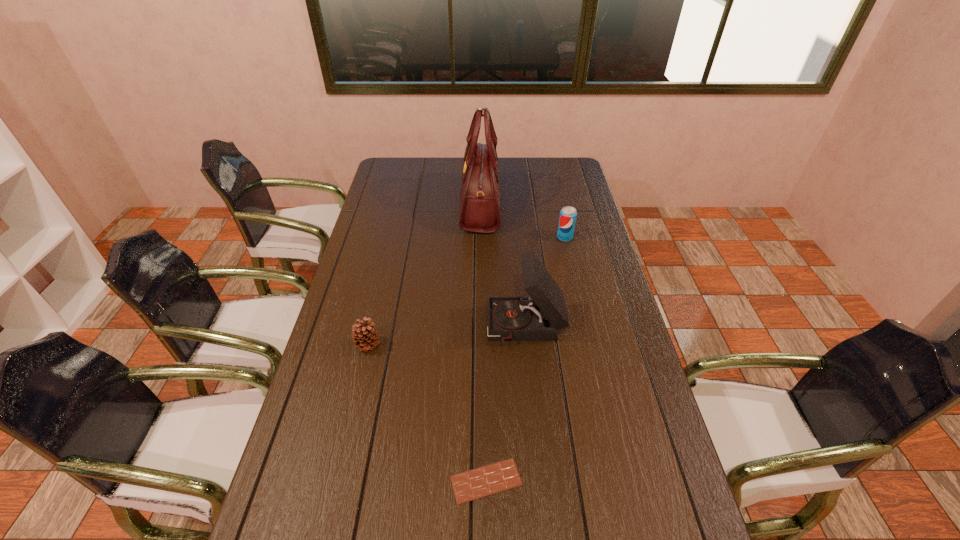
Identify the location of vacant space that is in between the leftmost object and the phonograph_record. Image resolution: width=960 pixels, height=540 pixels. (446, 336).

The image size is (960, 540). Identify the location of vacant space that is in between the rightmost object and the chocolate bar. (525, 359).

Where is `object that is the second closest one to the second tallest object`? The image size is (960, 540). object that is the second closest one to the second tallest object is located at coordinates tap(470, 485).

The height and width of the screenshot is (540, 960). Find the location of `object that stands as the fourth closest to the pinecone`. object that stands as the fourth closest to the pinecone is located at coordinates (568, 214).

Find the location of a particular element. The image size is (960, 540). vacant space that satisfies the following two spatial constraints: 1. on the front-facing side of the shortest object; 2. on the right side of the tallest object is located at coordinates (481, 481).

You are a GUI agent. You are given a task and a screenshot of the screen. Output one action in this format:
    pyautogui.click(x=<x>, y=<y>)
    Task: Click on the free space that satisfies the following two spatial constraints: 1. on the front-facing side of the shortest object; 2. on the right side of the tallest object
    The width and height of the screenshot is (960, 540).
    Given the screenshot: What is the action you would take?
    pyautogui.click(x=481, y=481)

This screenshot has width=960, height=540. What are the coordinates of `free spot that satisfies the following two spatial constraints: 1. on the front-facing side of the tallest object; 2. on the back side of the nearest object` in the screenshot? It's located at (481, 481).

What are the coordinates of `vacant position in the image that satisfies the following two spatial constraints: 1. on the front-facing side of the tallest object; 2. on the front side of the leftmost object` in the screenshot? It's located at (481, 345).

The image size is (960, 540). I want to click on free spot that satisfies the following two spatial constraints: 1. on the front-facing side of the chocolate bar; 2. on the left side of the tallest object, so click(481, 481).

This screenshot has width=960, height=540. In order to click on vacant region that satisfies the following two spatial constraints: 1. on the front-facing side of the handbag; 2. on the right side of the rightmost object in this screenshot , I will do 481,238.